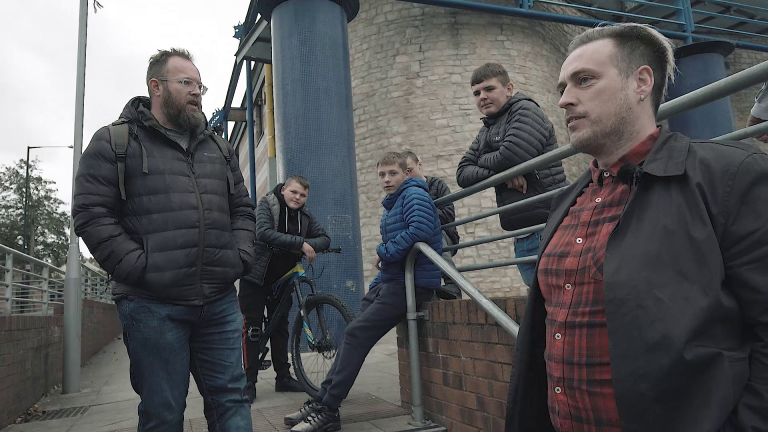
What are the coordinates of `blue column` in the screenshot? It's located at (312, 61).